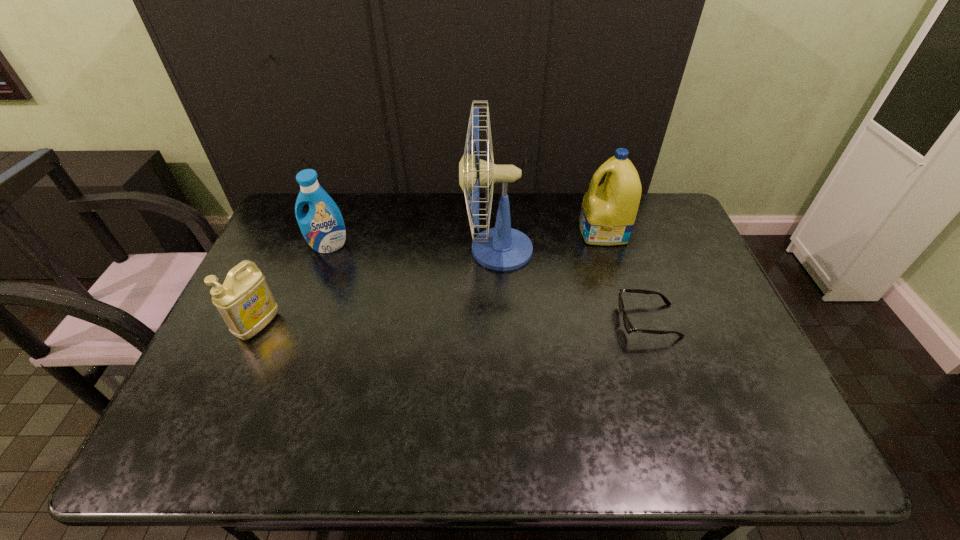
This screenshot has height=540, width=960. Identify the location of fan. (502, 248).

Identify the location of the tallest object. (502, 248).

Identify the location of the rightmost detergent. (608, 212).

This screenshot has width=960, height=540. What are the coordinates of `the shortest detergent` in the screenshot? It's located at (245, 302).

Locate an element on the screen. the nearest detergent is located at coordinates (245, 302).

In order to click on the shortest object in this screenshot , I will do coord(628,326).

Image resolution: width=960 pixels, height=540 pixels. Find the location of `free space located 0.300m at the front of the third object from left to right where the blades are visible`. free space located 0.300m at the front of the third object from left to right where the blades are visible is located at coordinates (369, 250).

At what (x,y) coordinates should I click in order to perform the action: click on vacant space located 0.110m at the front of the third object from left to right where the blades are visible. Please return your answer as a coordinate pair (x, y). Looking at the image, I should click on (428, 250).

This screenshot has height=540, width=960. I want to click on vacant space located at the front of the third object from left to right where the blades are visible, so click(x=378, y=250).

Identify the location of vacant region located 0.380m on the label of the rightmost detergent. The height and width of the screenshot is (540, 960). (467, 232).